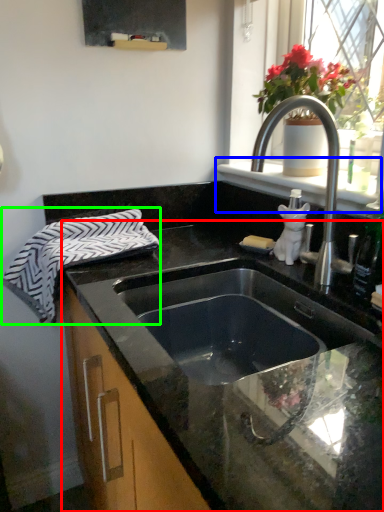
Question: Which object is positioned farthest from countertop (highlighted by a red box)? Select from window sill (highlighted by a blue box) and beach towel (highlighted by a green box).

Choices:
 (A) window sill
 (B) beach towel

Answer: (A)